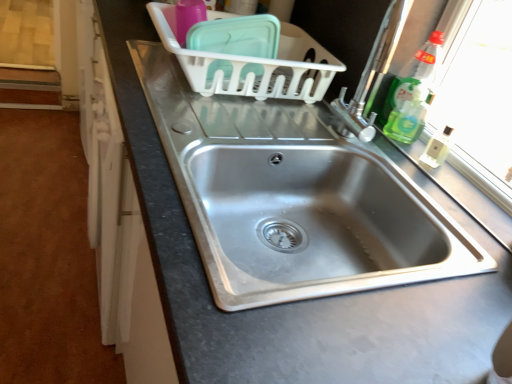
Measure the distance between green translucent liquid at right, the first bottle from the bottom, and camera.

The depth of green translucent liquid at right, the first bottle from the bottom, is 3.32 feet.

Describe the element at coordinates (413, 75) in the screenshot. I see `clear plastic bottle at upper right, the 2th bottle from the bottom` at that location.

The image size is (512, 384). What do you see at coordinates (253, 65) in the screenshot?
I see `white plastic basket at upper center` at bounding box center [253, 65].

At what (x,y) coordinates should I click in order to perform the action: click on stainless steel sink at center, which is the 1th sink from bottom to top. Please return your answer as a coordinate pair (x, y). This screenshot has height=384, width=512. Looking at the image, I should click on (293, 198).

What do you see at coordinates (372, 74) in the screenshot? The image size is (512, 384). I see `satin nickel faucet at right` at bounding box center [372, 74].

The image size is (512, 384). What are the coordinates of `satin nickel faucet at right` in the screenshot? It's located at (372, 74).

The width and height of the screenshot is (512, 384). What do you see at coordinates (437, 148) in the screenshot?
I see `clear plastic soap dispenser at right` at bounding box center [437, 148].

Measure the distance between point (298, 255) and camera.

Point (298, 255) is 34.92 inches from camera.

Where is `stainless steel sink at center, which is the second sink in bottom-to-top order`? The height and width of the screenshot is (384, 512). stainless steel sink at center, which is the second sink in bottom-to-top order is located at coordinates (310, 214).

The height and width of the screenshot is (384, 512). Identify the location of green translucent liquid at right, the second bottle from the top. (408, 116).

Is point (384, 127) closer to viewer compared to point (388, 106)?

No, it is behind (388, 106).

From the image's perspective, would you say green translucent liquid at right, the first bottle from the bottom, is positioned over clear plastic bottle at upper right, the 2th bottle from the bottom?

Incorrect, from the image's perspective, green translucent liquid at right, the first bottle from the bottom, is lower than clear plastic bottle at upper right, the 2th bottle from the bottom.

From a real-world perspective, between stainless steel sink at center, arranged as the first sink when viewed from the top, and satin nickel faucet at right, who is vertically higher?

From a 3D spatial view, satin nickel faucet at right is above.

Based on the photo, considering the relative positions of stainless steel sink at center, arranged as the first sink when viewed from the top, and satin nickel faucet at right in the image provided, is stainless steel sink at center, arranged as the first sink when viewed from the top, to the left of satin nickel faucet at right from the viewer's perspective?

Indeed, stainless steel sink at center, arranged as the first sink when viewed from the top, is positioned on the left side of satin nickel faucet at right.

Where is `the 1st sink in front of the satin nickel faucet at right`? This screenshot has height=384, width=512. the 1st sink in front of the satin nickel faucet at right is located at coordinates (310, 214).

Which of these two, stainless steel sink at center, which is the second sink in bottom-to-top order, or satin nickel faucet at right, stands shorter?

stainless steel sink at center, which is the second sink in bottom-to-top order, is shorter.

From the image's perspective, is clear plastic bottle at upper right, the 2th bottle from the bottom, beneath stainless steel sink at center, which is the second sink in bottom-to-top order?

Actually, clear plastic bottle at upper right, the 2th bottle from the bottom, appears above stainless steel sink at center, which is the second sink in bottom-to-top order, in the image.

Based on the photo, is clear plastic bottle at upper right, the 2th bottle from the bottom, further to the viewer compared to stainless steel sink at center, arranged as the first sink when viewed from the top?

Yes, it is behind stainless steel sink at center, arranged as the first sink when viewed from the top.

Would you say clear plastic bottle at upper right, the 2th bottle from the bottom, is to the left or to the right of stainless steel sink at center, which is the second sink in bottom-to-top order, in the picture?

Clearly, clear plastic bottle at upper right, the 2th bottle from the bottom, is on the right of stainless steel sink at center, which is the second sink in bottom-to-top order, in the image.

Does clear plastic bottle at upper right, positioned as the 1th bottle in top-to-bottom order, touch stainless steel sink at center, arranged as the first sink when viewed from the top?

No, clear plastic bottle at upper right, positioned as the 1th bottle in top-to-bottom order, is not in contact with stainless steel sink at center, arranged as the first sink when viewed from the top.

Based on the photo, from the image's perspective, which is above, clear plastic soap dispenser at right or satin nickel faucet at right?

From the image's view, satin nickel faucet at right is above.

Which point is more distant from viewer, [443,129] or [372,91]?

The point [443,129] is farther.

Considering the sizes of clear plastic soap dispenser at right and satin nickel faucet at right in the image, is clear plastic soap dispenser at right bigger or smaller than satin nickel faucet at right?

In the image, clear plastic soap dispenser at right appears to be smaller than satin nickel faucet at right.

Considering the sizes of objects clear plastic soap dispenser at right and satin nickel faucet at right in the image provided, who is shorter, clear plastic soap dispenser at right or satin nickel faucet at right?

clear plastic soap dispenser at right is shorter.

Is green translucent liquid at right, the first bottle from the bottom, a part of white plastic basket at upper center?

That's incorrect, green translucent liquid at right, the first bottle from the bottom, is not inside white plastic basket at upper center.

Is white plastic basket at upper center wider than green translucent liquid at right, the first bottle from the bottom?

Correct, the width of white plastic basket at upper center exceeds that of green translucent liquid at right, the first bottle from the bottom.

Between white plastic basket at upper center and green translucent liquid at right, the second bottle from the top, which one is positioned behind?

green translucent liquid at right, the second bottle from the top, is further away from the camera.

In the scene shown: How many degrees apart are the facing directions of white plastic basket at upper center and green translucent liquid at right, the first bottle from the bottom?

There is a 0.000628-degree angle between the facing directions of white plastic basket at upper center and green translucent liquid at right, the first bottle from the bottom.

Find the location of `sink that is the 2nd one when counting leftward from the clear plastic bottle at upper right, the 2th bottle from the bottom`. sink that is the 2nd one when counting leftward from the clear plastic bottle at upper right, the 2th bottle from the bottom is located at coordinates (293, 198).

From a real-world perspective, who is located higher, clear plastic bottle at upper right, the 2th bottle from the bottom, or stainless steel sink at center, which is the 2th sink from top to bottom?

In real-world perspective, clear plastic bottle at upper right, the 2th bottle from the bottom, is above.

Which of these two, clear plastic bottle at upper right, positioned as the 1th bottle in top-to-bottom order, or stainless steel sink at center, which is the 2th sink from top to bottom, is thinner?

clear plastic bottle at upper right, positioned as the 1th bottle in top-to-bottom order.

From the image's perspective, is clear plastic bottle at upper right, the 2th bottle from the bottom, over stainless steel sink at center, which is the 2th sink from top to bottom?

Yes.

Looking at this image, in terms of size, does clear plastic soap dispenser at right appear bigger or smaller than white plastic basket at upper center?

clear plastic soap dispenser at right is smaller than white plastic basket at upper center.

Consider the image. Between clear plastic soap dispenser at right and white plastic basket at upper center, which one appears on the right side from the viewer's perspective?

clear plastic soap dispenser at right is more to the right.

Does clear plastic soap dispenser at right have a lesser width compared to white plastic basket at upper center?

Yes.

I want to click on bottle below the clear plastic bottle at upper right, the 2th bottle from the bottom (from a real-world perspective), so click(x=408, y=116).

There is a satin nickel faucet at right. Where is `the 1st sink below it (from the image's perspective)`? the 1st sink below it (from the image's perspective) is located at coordinates (310, 214).

Looking at the image, which one is located further to clear plastic soap dispenser at right, stainless steel sink at center, which is the 1th sink from bottom to top, or green translucent liquid at right, the second bottle from the top?

Among the two, stainless steel sink at center, which is the 1th sink from bottom to top, is located further to clear plastic soap dispenser at right.

Based on their spatial positions, is stainless steel sink at center, which is the 2th sink from top to bottom, or white plastic basket at upper center further from green translucent liquid at right, the second bottle from the top?

The object further to green translucent liquid at right, the second bottle from the top, is stainless steel sink at center, which is the 2th sink from top to bottom.

From the image, which object appears to be nearer to stainless steel sink at center, arranged as the first sink when viewed from the top, green translucent liquid at right, the first bottle from the bottom, or satin nickel faucet at right?

satin nickel faucet at right is closer to stainless steel sink at center, arranged as the first sink when viewed from the top.

From the image, which object appears to be farther from stainless steel sink at center, which is the 1th sink from bottom to top, white plastic basket at upper center or clear plastic bottle at upper right, the 2th bottle from the bottom?

The object further to stainless steel sink at center, which is the 1th sink from bottom to top, is clear plastic bottle at upper right, the 2th bottle from the bottom.

Estimate the real-world distances between objects in this image. Which object is further from white plastic basket at upper center, stainless steel sink at center, which is the 1th sink from bottom to top, or green translucent liquid at right, the first bottle from the bottom?

green translucent liquid at right, the first bottle from the bottom, is further to white plastic basket at upper center.

Which object lies nearer to the anchor point green translucent liquid at right, the second bottle from the top, stainless steel sink at center, which is the 2th sink from top to bottom, or clear plastic soap dispenser at right?

The object closer to green translucent liquid at right, the second bottle from the top, is clear plastic soap dispenser at right.

Based on their spatial positions, is stainless steel sink at center, which is the second sink in bottom-to-top order, or stainless steel sink at center, which is the 1th sink from bottom to top, further from clear plastic bottle at upper right, positioned as the 1th bottle in top-to-bottom order?

Based on the image, stainless steel sink at center, which is the 1th sink from bottom to top, appears to be further to clear plastic bottle at upper right, positioned as the 1th bottle in top-to-bottom order.

Considering their positions, is green translucent liquid at right, the first bottle from the bottom, positioned further to stainless steel sink at center, which is the 1th sink from bottom to top, than satin nickel faucet at right?

Based on the image, green translucent liquid at right, the first bottle from the bottom, appears to be further to stainless steel sink at center, which is the 1th sink from bottom to top.

This screenshot has width=512, height=384. What are the coordinates of `sink located between stainless steel sink at center, which is the 2th sink from top to bottom, and green translucent liquid at right, the second bottle from the top, in the depth direction` in the screenshot? It's located at (310, 214).

Find the location of a particular element. tap between clear plastic bottle at upper right, the 2th bottle from the bottom, and stainless steel sink at center, which is the 2th sink from top to bottom, in the vertical direction is located at coordinates (372, 74).

Identify the location of toiletry positioned between satin nickel faucet at right and clear plastic bottle at upper right, positioned as the 1th bottle in top-to-bottom order, from near to far. (437, 148).

You are a GUI agent. You are given a task and a screenshot of the screen. Output one action in this format:
    pyautogui.click(x=<x>, y=<y>)
    Task: Click on the tap situated between white plastic basket at upper center and clear plastic bottle at upper right, positioned as the 1th bottle in top-to-bottom order, from left to right
    This screenshot has height=384, width=512.
    Given the screenshot: What is the action you would take?
    pyautogui.click(x=372, y=74)